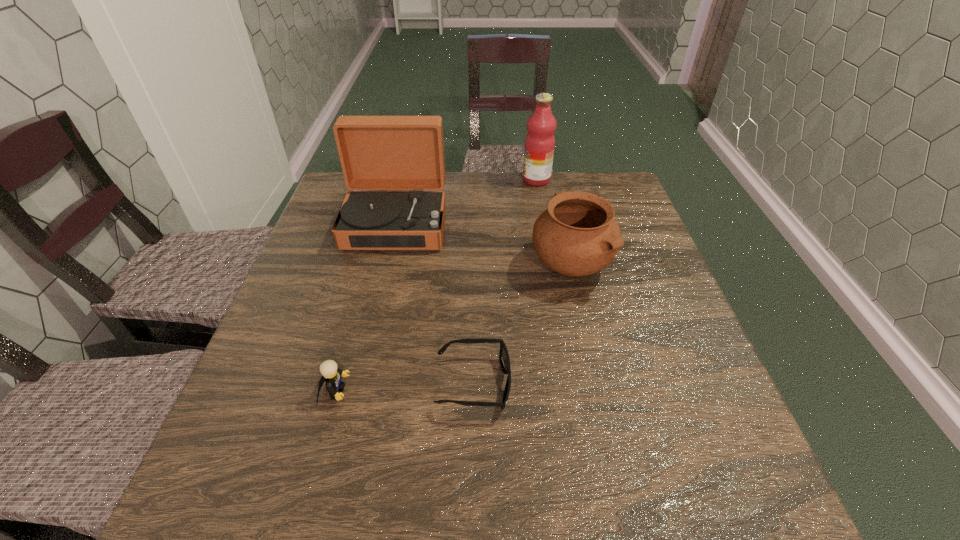
What are the coordinates of `the farthest object` in the screenshot? It's located at (540, 142).

Locate an element on the screen. This screenshot has height=540, width=960. phonograph record is located at coordinates (376, 152).

The height and width of the screenshot is (540, 960). Find the location of `pottery`. pottery is located at coordinates (577, 235).

Identify the location of Lego. The height and width of the screenshot is (540, 960). (331, 374).

Identify the location of sunglasses. (504, 358).

You are a GUI agent. You are given a task and a screenshot of the screen. Output one action in this format:
    pyautogui.click(x=<x>, y=<y>)
    Task: Click on the third object from right to left
    
    Given the screenshot: What is the action you would take?
    coord(504,358)

Find the location of a particular element. free region located 0.050m on the label of the farthest object is located at coordinates (506, 180).

Find the location of a particular element. The height and width of the screenshot is (540, 960). free space located on the label of the farthest object is located at coordinates (481, 180).

You are a GUI agent. You are given a task and a screenshot of the screen. Output one action in this format:
    pyautogui.click(x=<x>, y=<y>)
    Task: Click on the vacant space situated on the label of the farthest object
    
    Given the screenshot: What is the action you would take?
    pyautogui.click(x=417, y=180)

Image resolution: width=960 pixels, height=540 pixels. I want to click on vacant space located on the face of the phonograph record, so click(360, 376).